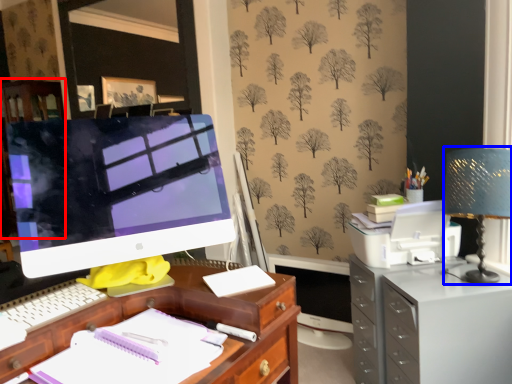
Question: Which of the following is the closest to the observer, dresser (highlighted by a red box) or table lamp (highlighted by a blue box)?

Choices:
 (A) dresser
 (B) table lamp

Answer: (B)